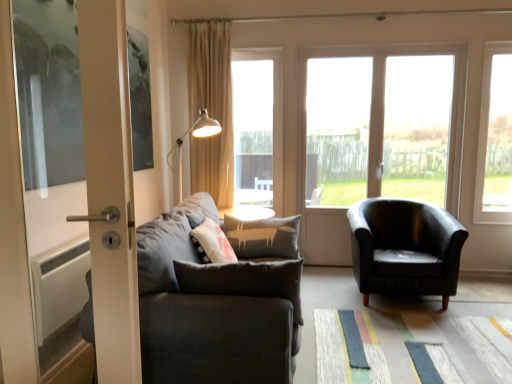
Question: Are textured multicolored mat at lower center and transparent glass door at center, the third window viewed from the left, far apart?

Choices:
 (A) yes
 (B) no

Answer: (A)

Question: Does textured multicolored mat at lower center have a larger size compared to transparent glass door at center, which ranks as the 2th window in right-to-left order?

Choices:
 (A) no
 (B) yes

Answer: (A)

Question: From the image's perspective, is textured multicolored mat at lower center above transparent glass door at center, which ranks as the 2th window in right-to-left order?

Choices:
 (A) no
 (B) yes

Answer: (A)

Question: Does textured multicolored mat at lower center have a lesser width compared to transparent glass door at center, which ranks as the 2th window in right-to-left order?

Choices:
 (A) no
 (B) yes

Answer: (A)

Question: Is textured multicolored mat at lower center next to transparent glass door at center, which ranks as the 2th window in right-to-left order, and touching it?

Choices:
 (A) yes
 (B) no

Answer: (B)

Question: Does textured multicolored mat at lower center have a greater height compared to transparent glass door at center, which ranks as the 2th window in right-to-left order?

Choices:
 (A) no
 (B) yes

Answer: (A)

Question: From the image's perspective, is beige fabric curtain at upper center on transparent glass window at center, which is the 2th window from left to right?

Choices:
 (A) yes
 (B) no

Answer: (A)

Question: Can you confirm if beige fabric curtain at upper center is smaller than transparent glass window at center, which is the 2th window from left to right?

Choices:
 (A) yes
 (B) no

Answer: (B)

Question: From a real-world perspective, is beige fabric curtain at upper center beneath transparent glass window at center, which is the 2th window from left to right?

Choices:
 (A) yes
 (B) no

Answer: (B)

Question: From the image's perspective, does beige fabric curtain at upper center appear lower than transparent glass window at center, which is the 2th window from left to right?

Choices:
 (A) no
 (B) yes

Answer: (A)

Question: Can you confirm if beige fabric curtain at upper center is taller than transparent glass window at center, which is the 2th window from left to right?

Choices:
 (A) yes
 (B) no

Answer: (B)

Question: Is beige fabric curtain at upper center to the left of transparent glass window at center, which ranks as the 3th window in right-to-left order, from the viewer's perspective?

Choices:
 (A) yes
 (B) no

Answer: (A)

Question: Does dark gray fabric couch at left turn towards transparent glass window at right, which is the 1th window in right-to-left order?

Choices:
 (A) no
 (B) yes

Answer: (B)